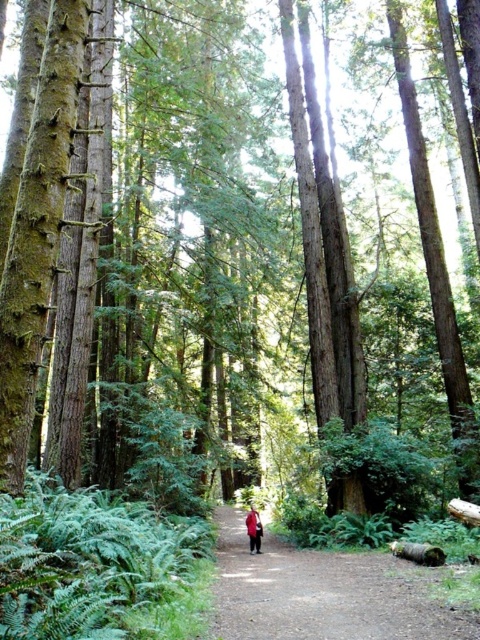
Question: Can you confirm if dirt path at center is positioned to the left of red fabric coat at center?

Choices:
 (A) yes
 (B) no

Answer: (B)

Question: Which point is closer to the camera?

Choices:
 (A) (262, 582)
 (B) (260, 545)

Answer: (A)

Question: Does dirt path at center appear on the left side of red fabric coat at center?

Choices:
 (A) yes
 (B) no

Answer: (B)

Question: Which point is farther from the camera taking this photo?

Choices:
 (A) (262, 528)
 (B) (292, 557)

Answer: (A)

Question: Is the position of dirt path at center less distant than that of red fabric coat at center?

Choices:
 (A) no
 (B) yes

Answer: (B)